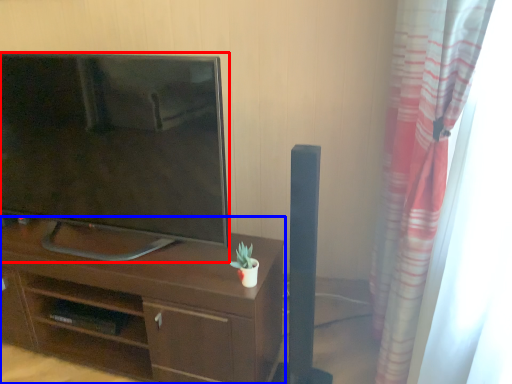
Question: Which object appears closest to the camera in this image, television (highlighted by a red box) or desk (highlighted by a blue box)?

Choices:
 (A) television
 (B) desk

Answer: (A)